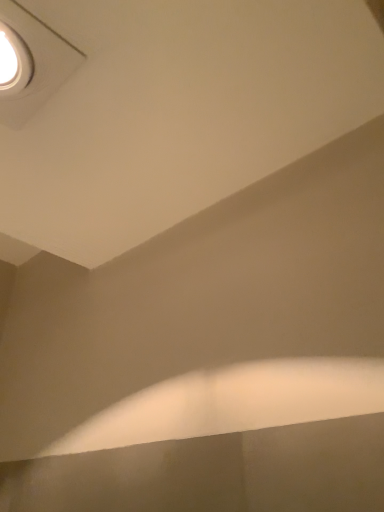
This screenshot has width=384, height=512. Identify the location of white plastic lamp at upper left. (34, 63).

This screenshot has width=384, height=512. Describe the element at coordinates (34, 63) in the screenshot. I see `white plastic lamp at upper left` at that location.

What are the coordinates of `white plastic lamp at upper left` in the screenshot? It's located at (34, 63).